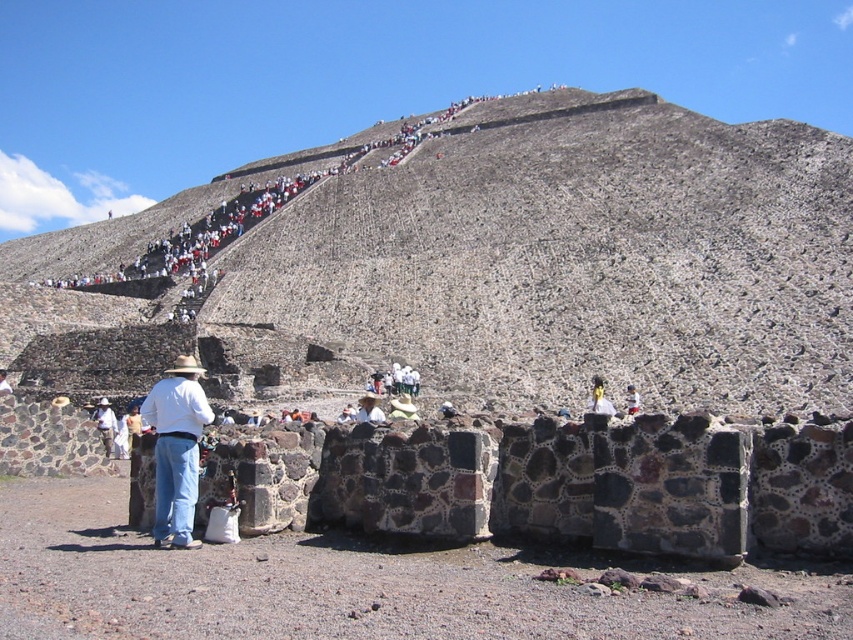
Between point (532, 148) and point (593, 381), which one is positioned behind?

The point (532, 148) is more distant.

Does rough stone pyramid at upper center appear over yellow fabric hat at center?

Correct, rough stone pyramid at upper center is located above yellow fabric hat at center.

Who is more distant from viewer, [705,147] or [601,400]?

Point [705,147]

I want to click on rough stone pyramid at upper center, so click(577, 256).

Between rough stone pyramid at upper center and white woven hat at center, which one appears on the right side from the viewer's perspective?

From the viewer's perspective, rough stone pyramid at upper center appears more on the right side.

Does point (619, 296) come in front of point (96, 419)?

That is False.

Where is `rough stone pyramid at upper center`? The image size is (853, 640). rough stone pyramid at upper center is located at coordinates (577, 256).

Which is in front, point (561, 333) or point (196, 484)?

Point (196, 484)

Describe the element at coordinates (577, 256) in the screenshot. The width and height of the screenshot is (853, 640). I see `rough stone pyramid at upper center` at that location.

Where is `rough stone pyramid at upper center`? This screenshot has width=853, height=640. rough stone pyramid at upper center is located at coordinates (577, 256).